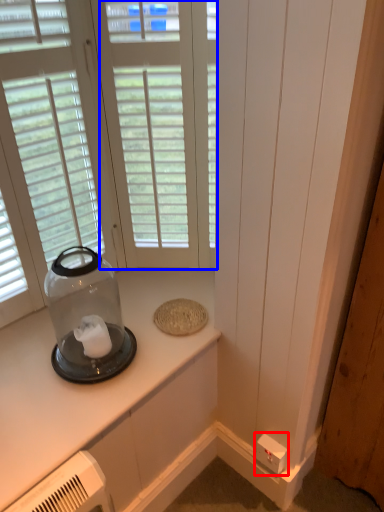
Question: Among these objects, which one is nearest to the camera, electric outlet (highlighted by a red box) or window (highlighted by a blue box)?

Choices:
 (A) electric outlet
 (B) window

Answer: (B)